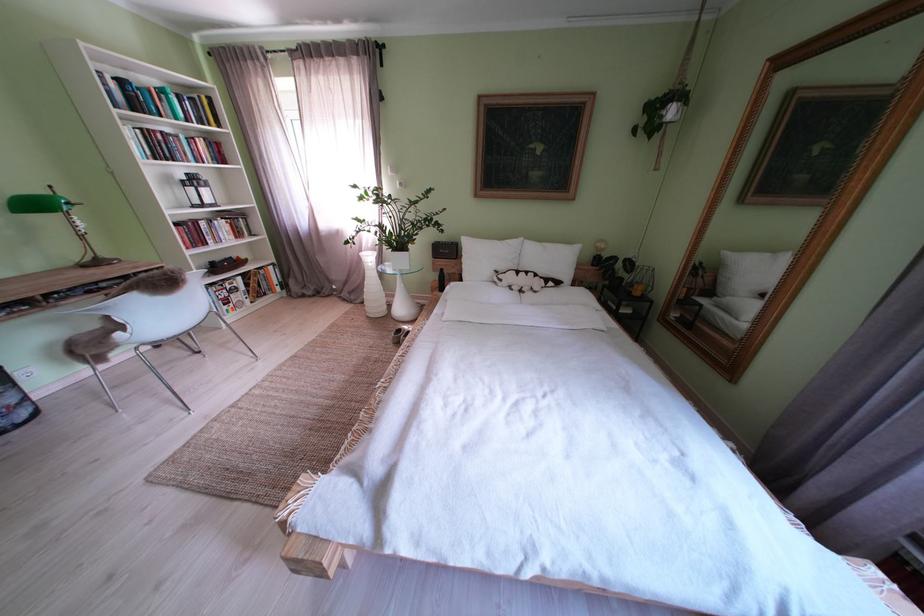
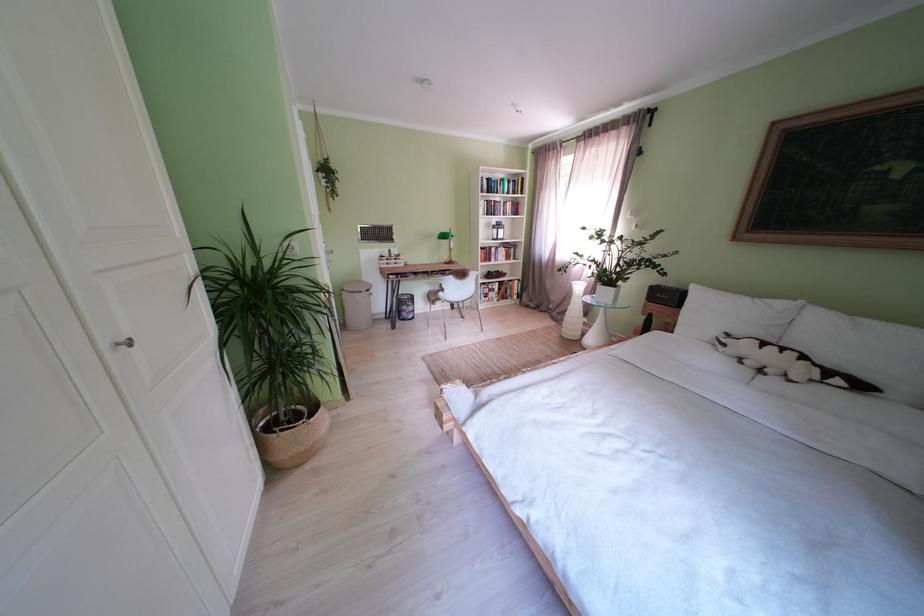
Question: The camera is either moving clockwise (left) or counter-clockwise (right) around the object. The first image is from the beginning of the video and the second image is from the end. Is the camera moving left or right when shooting the video?

Choices:
 (A) Left
 (B) Right

Answer: (B)